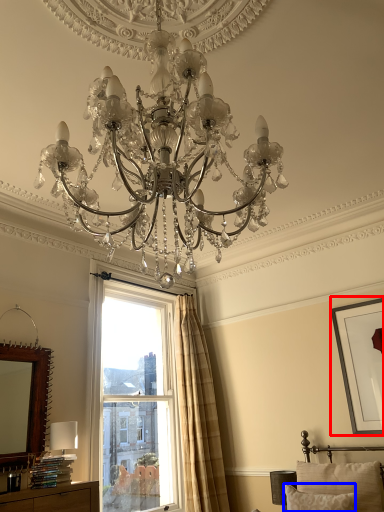
Question: Which object is closer to the camera taking this photo, picture frame (highlighted by a red box) or pillow (highlighted by a blue box)?

Choices:
 (A) picture frame
 (B) pillow

Answer: (B)